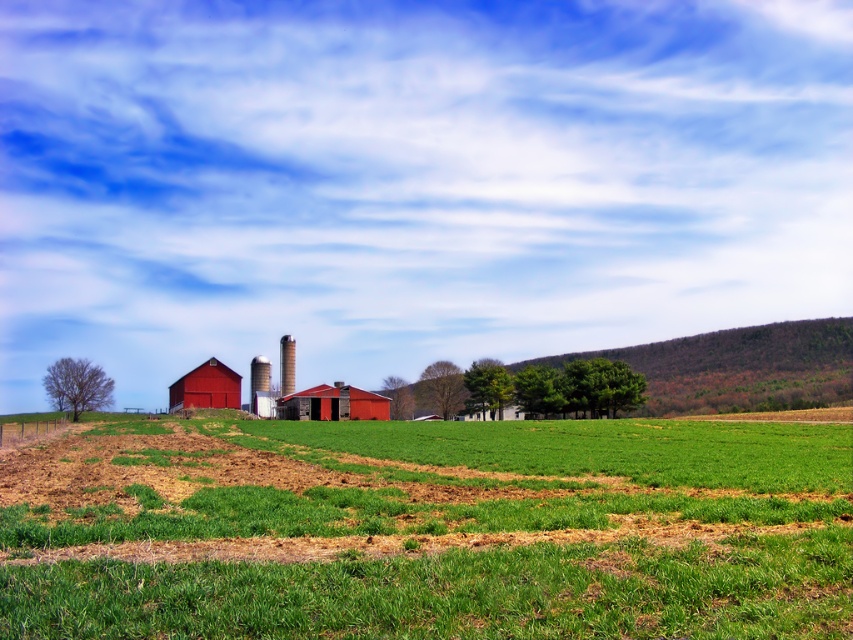
Which is above, rustic metal silo at center or smooth white silo at center?

Positioned higher is rustic metal silo at center.

Is the position of rustic metal silo at center less distant than that of smooth white silo at center?

No, rustic metal silo at center is behind smooth white silo at center.

Which is behind, point (282, 352) or point (252, 385)?

Positioned behind is point (282, 352).

Locate an element on the screen. The height and width of the screenshot is (640, 853). rustic metal silo at center is located at coordinates (286, 364).

Between green grassy field at center and rustic metal silo at center, which one has more height?

rustic metal silo at center

Is green grassy field at center taller than rustic metal silo at center?

Incorrect, green grassy field at center's height is not larger of rustic metal silo at center's.

Identify the location of green grassy field at center. (427, 529).

Who is more distant from viewer, (259,458) or (173,397)?

The point (173,397) is behind.

Where is `green grassy field at center`? green grassy field at center is located at coordinates (427, 529).